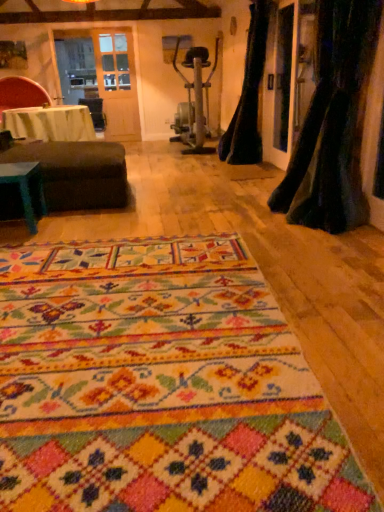
Question: Should I look upward or downward to see velvet black curtain at right, placed as the 1th curtain when sorted from back to front?

Choices:
 (A) up
 (B) down

Answer: (A)

Question: Should I look upward or downward to see white cloth-covered table at left, the 2th table when ordered from bottom to top?

Choices:
 (A) up
 (B) down

Answer: (A)

Question: Is white cloth-covered table at left, which ranks as the 1th table in back-to-front order, at the back of velvet black curtain at right, placed as the 1th curtain when sorted from back to front?

Choices:
 (A) no
 (B) yes

Answer: (A)

Question: Does velvet black curtain at right, placed as the 1th curtain when sorted from back to front, have a smaller size compared to white cloth-covered table at left, acting as the 2th table starting from the front?

Choices:
 (A) yes
 (B) no

Answer: (B)

Question: Is velvet black curtain at right, which is the 2th curtain from front to back, next to white cloth-covered table at left, acting as the 2th table starting from the front?

Choices:
 (A) no
 (B) yes

Answer: (A)

Question: Can we say velvet black curtain at right, which is the 2th curtain from front to back, lies outside white cloth-covered table at left, the 2th table when ordered from bottom to top?

Choices:
 (A) no
 (B) yes

Answer: (B)

Question: From a real-world perspective, is velvet black curtain at right, which is the 2th curtain from front to back, positioned under white cloth-covered table at left, which is the 1th table from top to bottom, based on gravity?

Choices:
 (A) no
 (B) yes

Answer: (A)

Question: Is velvet black curtain at right, which is the 2th curtain from front to back, oriented towards white cloth-covered table at left, which ranks as the 1th table in back-to-front order?

Choices:
 (A) yes
 (B) no

Answer: (A)

Question: Is dark brown fabric ottoman at left positioned behind green felt table at left, placed as the 2th table when sorted from back to front?

Choices:
 (A) no
 (B) yes

Answer: (B)

Question: Can you confirm if dark brown fabric ottoman at left is positioned to the left of green felt table at left, arranged as the 1th table when ordered from the bottom?

Choices:
 (A) yes
 (B) no

Answer: (B)

Question: Considering the relative sizes of dark brown fabric ottoman at left and green felt table at left, which is counted as the 1th table, starting from the front, in the image provided, is dark brown fabric ottoman at left thinner than green felt table at left, which is counted as the 1th table, starting from the front,?

Choices:
 (A) yes
 (B) no

Answer: (B)

Question: Does dark brown fabric ottoman at left have a smaller size compared to green felt table at left, which is counted as the 1th table, starting from the front?

Choices:
 (A) yes
 (B) no

Answer: (B)

Question: Is dark brown fabric ottoman at left located outside green felt table at left, placed as the 2th table when sorted from back to front?

Choices:
 (A) no
 (B) yes

Answer: (B)

Question: From the image's perspective, is dark brown fabric ottoman at left on green felt table at left, which ranks as the second table in top-to-bottom order?

Choices:
 (A) yes
 (B) no

Answer: (A)

Question: From a real-world perspective, is black velvet curtain at right, which is counted as the first curtain, starting from the front, physically below multicolored woven rug at center?

Choices:
 (A) yes
 (B) no

Answer: (B)